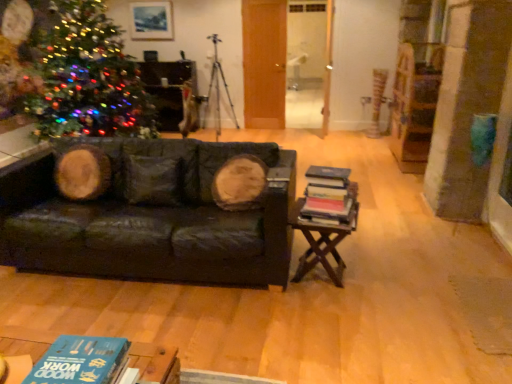
Locate an element on the screen. Image resolution: width=512 pixels, height=384 pixels. blank space situated above blue matte book at lower left, marked as the second book in a right-to-left arrangement (from a real-world perspective) is located at coordinates (85, 358).